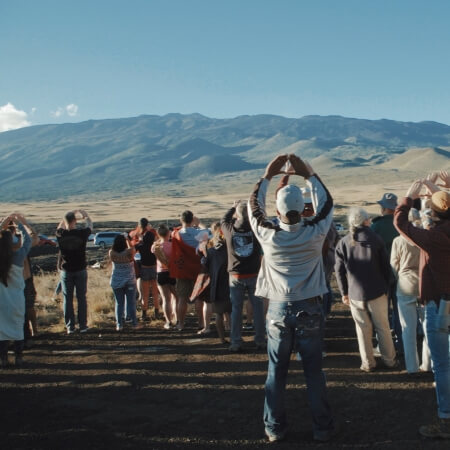
Locate an element on the screen. Image resolution: width=450 pixels, height=450 pixels. glass window is located at coordinates (103, 235).